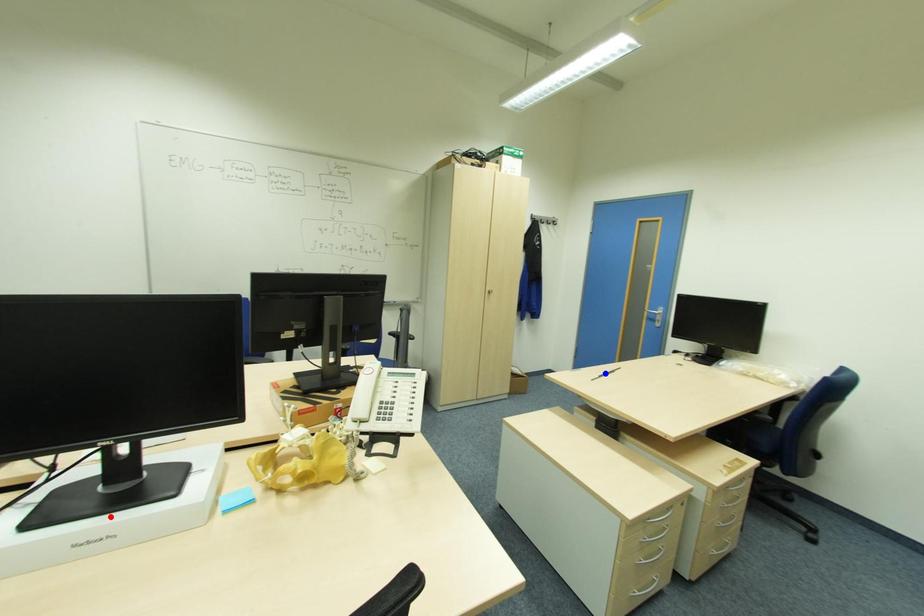
Question: Which of the two points in the image is closer to the camera?

Choices:
 (A) Blue point is closer.
 (B) Red point is closer.

Answer: (B)